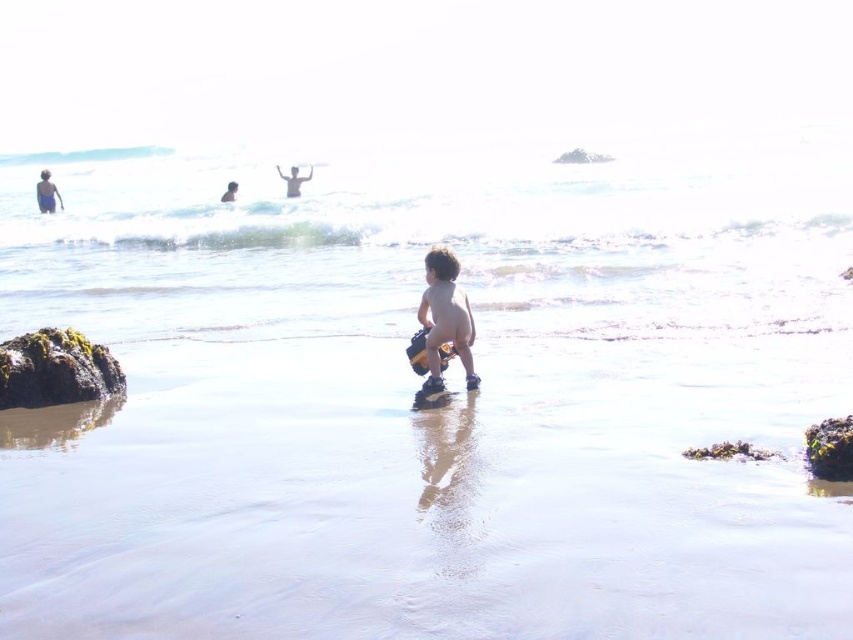
Question: Is clear water at lower center positioned before skinny white person at upper center?

Choices:
 (A) yes
 (B) no

Answer: (A)

Question: Which point is farther to the camera?

Choices:
 (A) green mossy rock at lower left
 (B) skinny white person at upper center
 (C) clear water at lower center
 (D) smooth sand at center

Answer: (B)

Question: Which of the following is the farthest from the observer?

Choices:
 (A) smooth skin boy at center
 (B) skinny white person at upper center
 (C) smooth sand at center

Answer: (B)

Question: Is smooth sand at center thinner than clear water at lower center?

Choices:
 (A) no
 (B) yes

Answer: (B)

Question: Which point is farther from the camera taking this photo?

Choices:
 (A) (109, 364)
 (B) (431, 268)

Answer: (A)

Question: Is smooth sand at center closer to the viewer compared to green mossy rock at lower left?

Choices:
 (A) no
 (B) yes

Answer: (B)